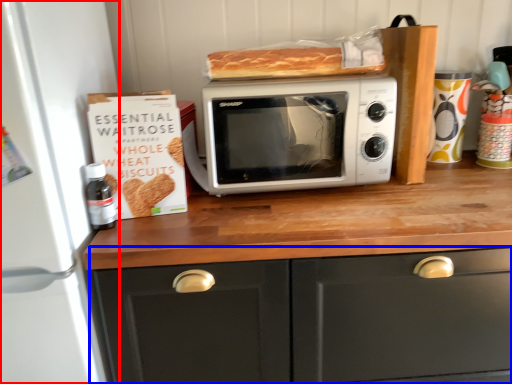
Question: Which point is closer to the camera, appliance (highlighted by a red box) or cabinetry (highlighted by a blue box)?

Choices:
 (A) appliance
 (B) cabinetry

Answer: (A)